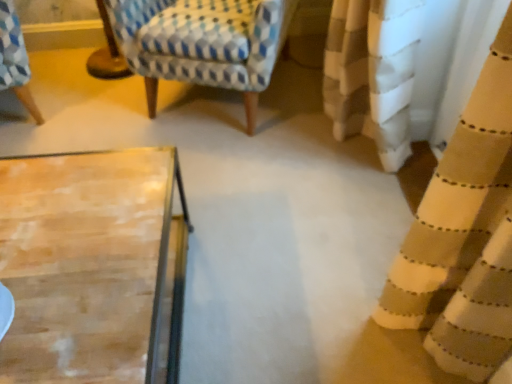
Find the location of a particular element. vacant space that's between patterned fabric rocking chair at upper left and beige textured curtain at right is located at coordinates (301, 162).